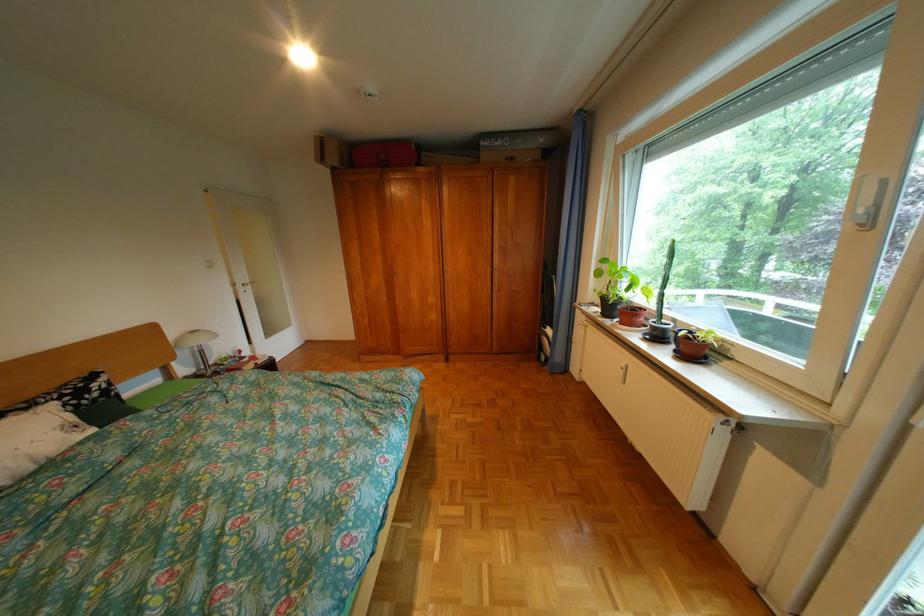
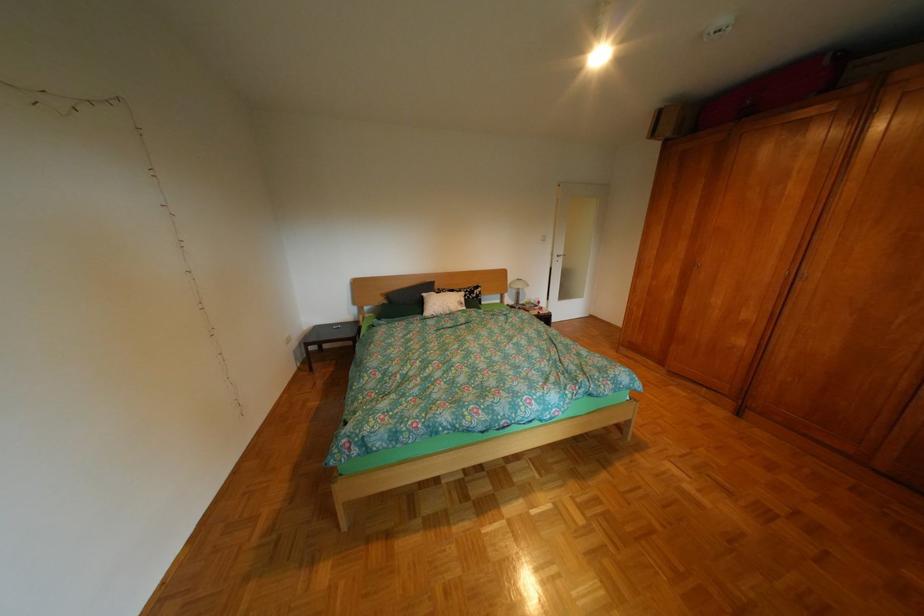
Where in the second image is the point corresponding to the point at 188,358 from the first image?

(521, 292)